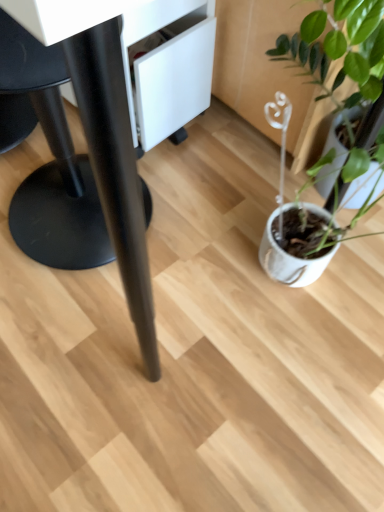
Question: Can you confirm if black matte table at center is thinner than black matte swivel chair at left?

Choices:
 (A) yes
 (B) no

Answer: (B)

Question: Considering the relative positions of black matte table at center and black matte swivel chair at left in the image provided, is black matte table at center to the right of black matte swivel chair at left from the viewer's perspective?

Choices:
 (A) yes
 (B) no

Answer: (A)

Question: Considering the relative positions of black matte table at center and black matte swivel chair at left in the image provided, is black matte table at center to the left of black matte swivel chair at left from the viewer's perspective?

Choices:
 (A) no
 (B) yes

Answer: (A)

Question: Is black matte table at center looking in the opposite direction of black matte swivel chair at left?

Choices:
 (A) yes
 (B) no

Answer: (A)

Question: Can you confirm if black matte table at center is wider than black matte swivel chair at left?

Choices:
 (A) yes
 (B) no

Answer: (A)

Question: Is black matte table at center aimed at black matte swivel chair at left?

Choices:
 (A) yes
 (B) no

Answer: (A)

Question: Considering the relative sizes of white matte pot at right and black matte swivel chair at left in the image provided, is white matte pot at right thinner than black matte swivel chair at left?

Choices:
 (A) yes
 (B) no

Answer: (A)

Question: From the image's perspective, would you say white matte pot at right is shown under black matte swivel chair at left?

Choices:
 (A) yes
 (B) no

Answer: (A)

Question: Does white matte pot at right appear on the left side of black matte swivel chair at left?

Choices:
 (A) yes
 (B) no

Answer: (B)

Question: Does white matte pot at right turn towards black matte swivel chair at left?

Choices:
 (A) no
 (B) yes

Answer: (A)

Question: Is white matte pot at right to the right of black matte swivel chair at left from the viewer's perspective?

Choices:
 (A) yes
 (B) no

Answer: (A)

Question: Is white matte pot at right next to black matte swivel chair at left?

Choices:
 (A) no
 (B) yes

Answer: (A)

Question: From a real-world perspective, is white matte pot at right located beneath black matte table at center?

Choices:
 (A) yes
 (B) no

Answer: (A)